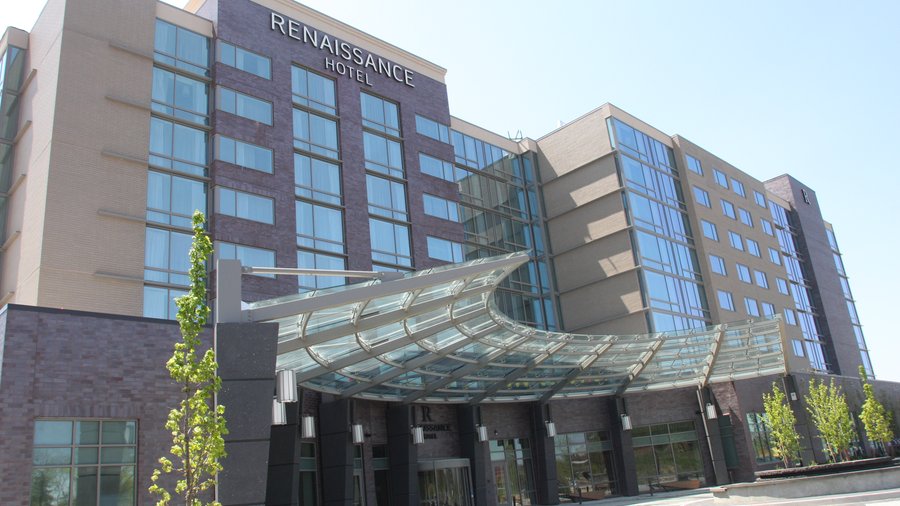
The height and width of the screenshot is (506, 900). I want to click on concrete wall, so click(848, 477).